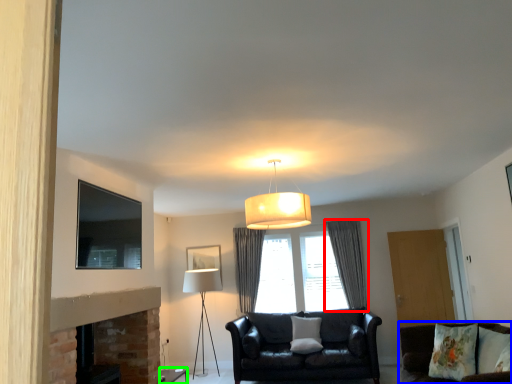
Question: Which object is positioned closest to curtain (highlighted by a red box)? Select from studio couch (highlighted by a blue box) and side table (highlighted by a green box).

Choices:
 (A) studio couch
 (B) side table

Answer: (A)